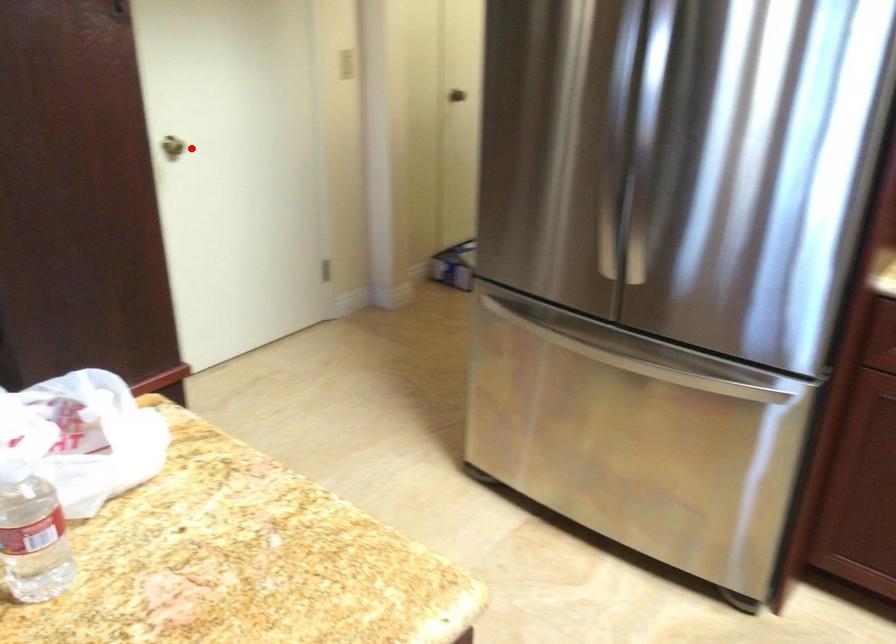
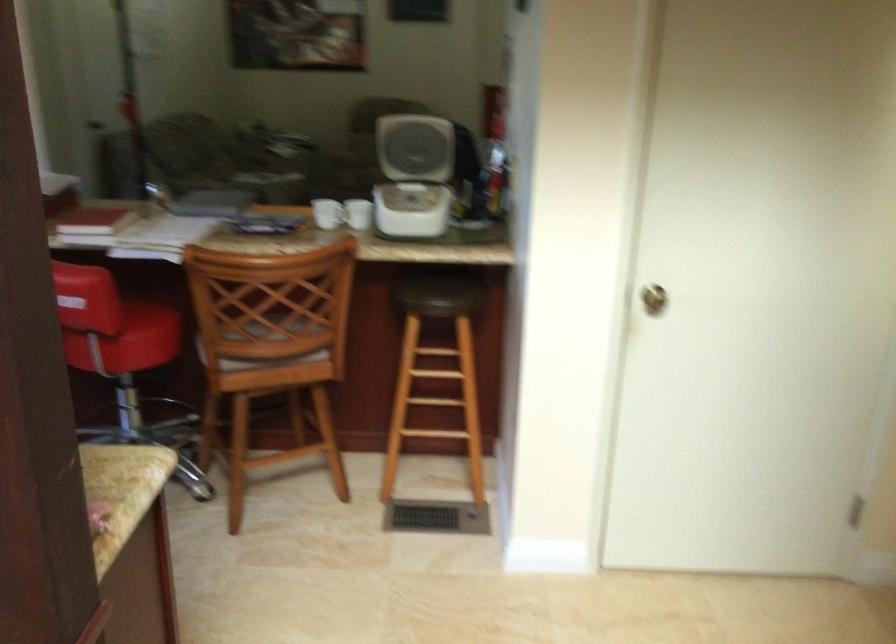
Question: I am providing you with two images of the same scene from different viewpoints. In image1, a red point is highlighted. Considering the same 3D point in image2, which of the following is correct?

Choices:
 (A) It is closer
 (B) It is farther

Answer: (A)